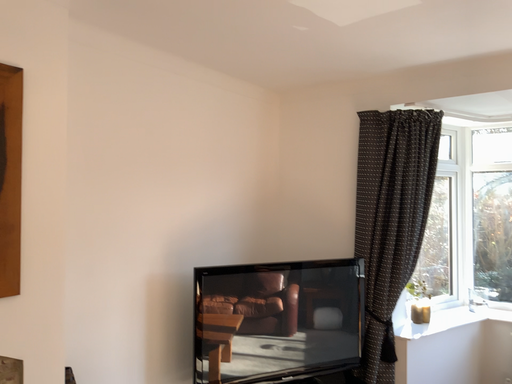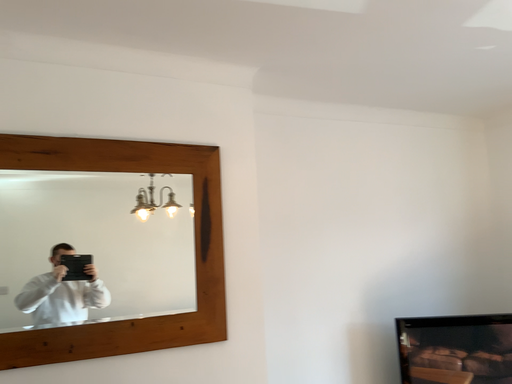
Question: How did the camera likely rotate when shooting the video?

Choices:
 (A) rotated right
 (B) rotated left

Answer: (B)